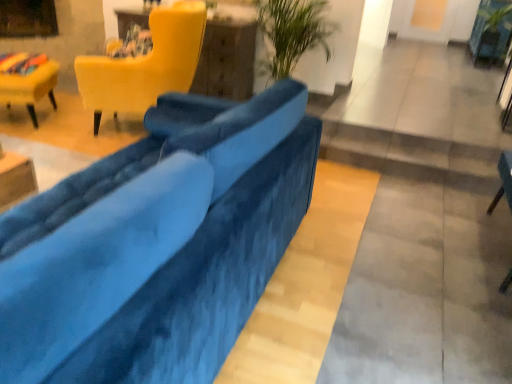
Question: Is velvet yellow chair at left, arranged as the 1th chair when viewed from the left, shorter than velvet blue chair at lower right, acting as the first chair starting from the right?

Choices:
 (A) yes
 (B) no

Answer: (A)

Question: Would you say velvet yellow chair at left, arranged as the 1th chair when viewed from the left, is outside velvet blue chair at lower right, acting as the third chair starting from the left?

Choices:
 (A) no
 (B) yes

Answer: (B)

Question: Does velvet yellow chair at left, arranged as the 1th chair when viewed from the left, appear on the right side of velvet blue chair at lower right, acting as the third chair starting from the left?

Choices:
 (A) no
 (B) yes

Answer: (A)

Question: Is the position of velvet yellow chair at left, arranged as the 1th chair when viewed from the left, more distant than that of velvet blue chair at lower right, acting as the first chair starting from the right?

Choices:
 (A) yes
 (B) no

Answer: (A)

Question: Is there a large distance between velvet yellow chair at left, arranged as the 1th chair when viewed from the left, and velvet blue chair at lower right, acting as the third chair starting from the left?

Choices:
 (A) no
 (B) yes

Answer: (B)

Question: From a real-world perspective, is velvet yellow chair at left, arranged as the third chair when viewed from the right, physically below velvet blue chair at lower right, acting as the third chair starting from the left?

Choices:
 (A) no
 (B) yes

Answer: (B)

Question: Is green leafy plant at upper right smaller than velvet blue couch at center?

Choices:
 (A) yes
 (B) no

Answer: (A)

Question: Is green leafy plant at upper right behind velvet blue couch at center?

Choices:
 (A) yes
 (B) no

Answer: (A)

Question: Is green leafy plant at upper right aimed at velvet blue couch at center?

Choices:
 (A) no
 (B) yes

Answer: (A)

Question: Considering the relative sizes of green leafy plant at upper right and velvet blue couch at center in the image provided, is green leafy plant at upper right thinner than velvet blue couch at center?

Choices:
 (A) no
 (B) yes

Answer: (B)

Question: Is green leafy plant at upper right in front of velvet blue couch at center?

Choices:
 (A) no
 (B) yes

Answer: (A)

Question: Would you say green leafy plant at upper right is a long distance from velvet blue couch at center?

Choices:
 (A) yes
 (B) no

Answer: (A)

Question: Does green leafy plant at upper right have a lesser height compared to velvet blue chair at lower right, acting as the first chair starting from the right?

Choices:
 (A) yes
 (B) no

Answer: (A)